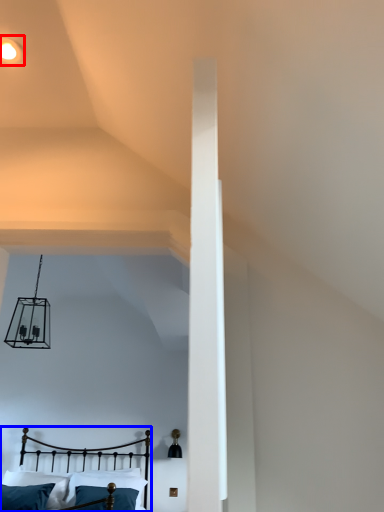
Question: Among these objects, which one is nearest to the camera, light fixture (highlighted by a red box) or bed (highlighted by a blue box)?

Choices:
 (A) light fixture
 (B) bed

Answer: (A)